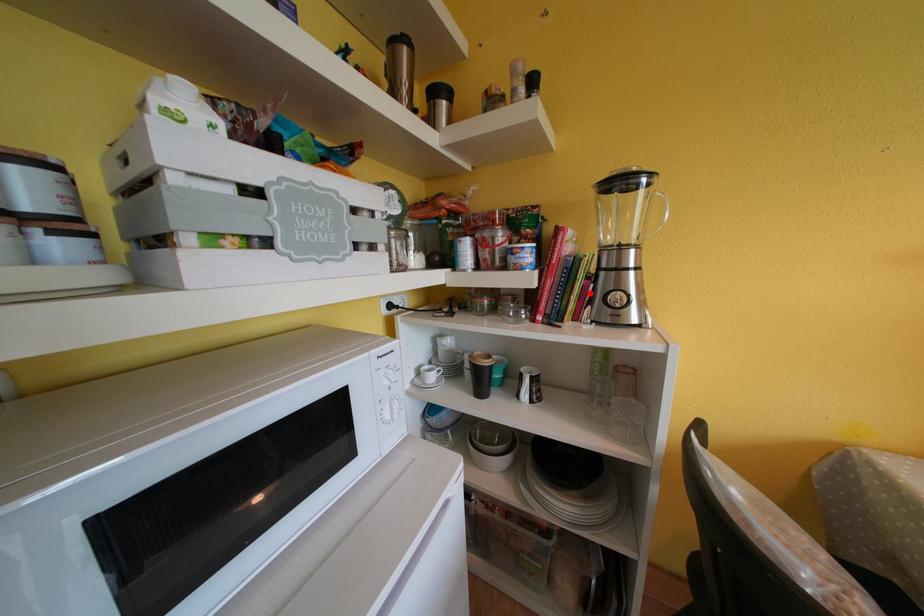
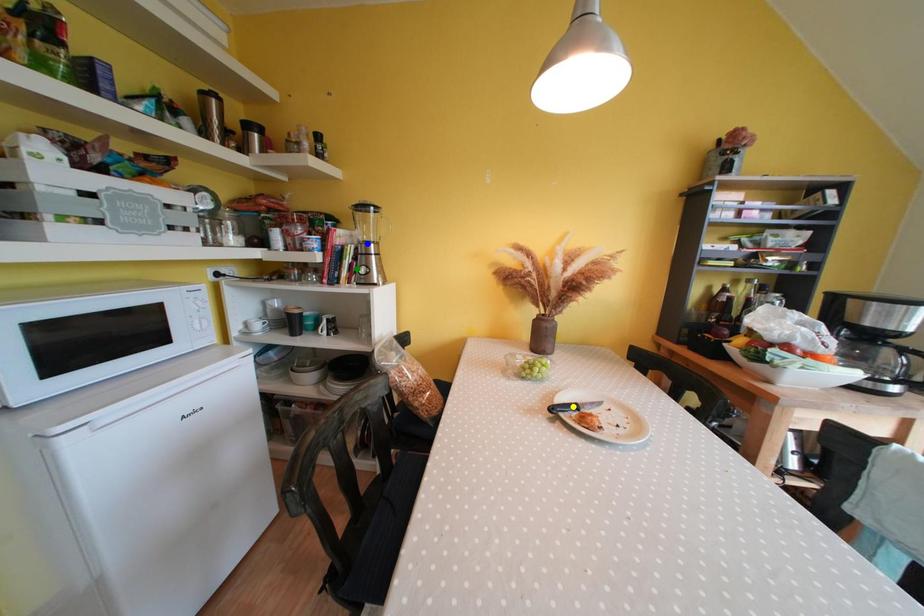
Question: I am providing you with two images of the same scene from different viewpoints. A red point is marked on the first image. You are given multiple points on the second image. Can you choose the point in image 2 that corresponds to the point in image 1?

Choices:
 (A) blue point
 (B) yellow point
 (C) green point

Answer: (C)